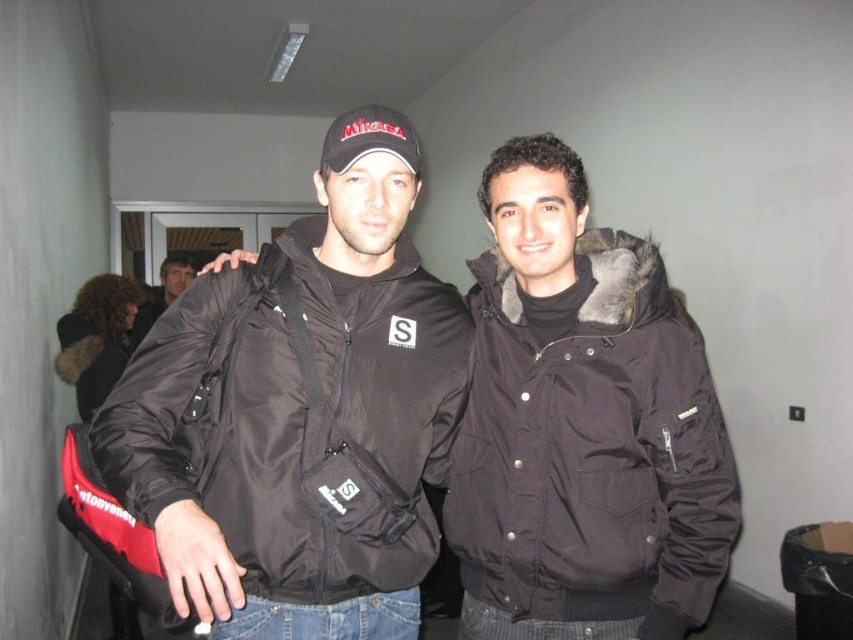
Is black matte jacket at center to the left of matte black jacket at center from the viewer's perspective?

Answer: No, black matte jacket at center is not to the left of matte black jacket at center.

The image size is (853, 640). What do you see at coordinates (582, 426) in the screenshot?
I see `black matte jacket at center` at bounding box center [582, 426].

Describe the element at coordinates (582, 426) in the screenshot. The image size is (853, 640). I see `black matte jacket at center` at that location.

Locate an element on the screen. This screenshot has width=853, height=640. black matte jacket at center is located at coordinates (582, 426).

Can you confirm if black synthetic jacket at center is positioned below black synthetic fur-lined jacket at center?

Incorrect, black synthetic jacket at center is not positioned below black synthetic fur-lined jacket at center.

Does black synthetic jacket at center have a lesser height compared to black synthetic fur-lined jacket at center?

Indeed, black synthetic jacket at center has a lesser height compared to black synthetic fur-lined jacket at center.

What are the coordinates of `black synthetic jacket at center` in the screenshot? It's located at (296, 417).

Between black synthetic fur-lined jacket at center and matte black jacket at center, which one has less height?

Standing shorter between the two is matte black jacket at center.

Identify the location of black synthetic fur-lined jacket at center. pyautogui.click(x=592, y=452).

Find the location of a particular element. The height and width of the screenshot is (640, 853). black synthetic fur-lined jacket at center is located at coordinates (592, 452).